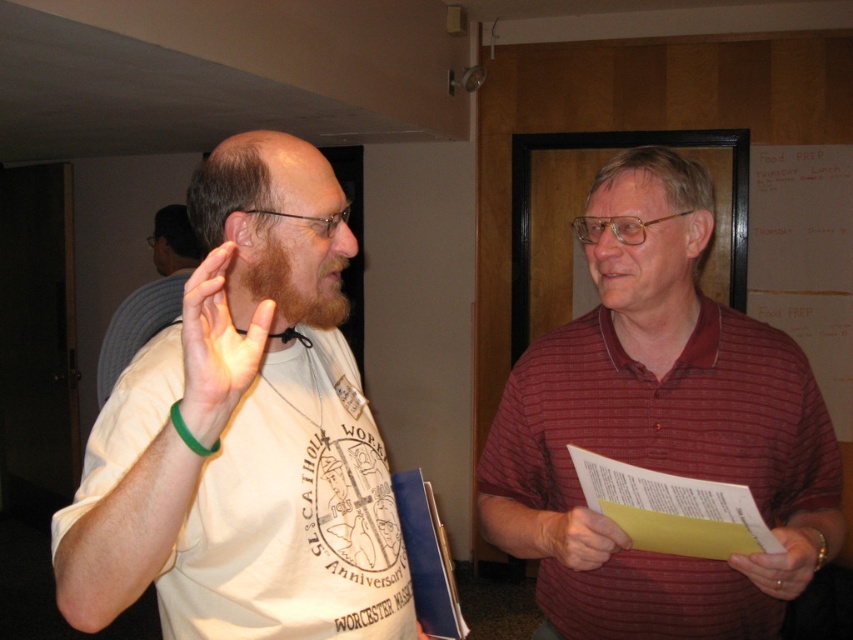
Can you confirm if matte white t-shirt at left is positioned above striped cotton shirt at center?

No, matte white t-shirt at left is not above striped cotton shirt at center.

Is matte white t-shirt at left wider than striped cotton shirt at center?

In fact, matte white t-shirt at left might be narrower than striped cotton shirt at center.

The image size is (853, 640). Find the location of `matte white t-shirt at left`. matte white t-shirt at left is located at coordinates (241, 433).

Does matte white t-shirt at left have a smaller size compared to matte white shirt at center?

Indeed, matte white t-shirt at left has a smaller size compared to matte white shirt at center.

Is the position of matte white t-shirt at left less distant than that of matte white shirt at center?

That is True.

Does point (344, 516) come closer to viewer compared to point (160, 234)?

Yes.

Find the location of `matte white t-shirt at left`. matte white t-shirt at left is located at coordinates (241, 433).

Looking at this image, can you confirm if striped cotton shirt at center is shorter than matte white shirt at center?

Incorrect, striped cotton shirt at center's height does not fall short of matte white shirt at center's.

Can you confirm if striped cotton shirt at center is smaller than matte white shirt at center?

Indeed, striped cotton shirt at center has a smaller size compared to matte white shirt at center.

Does point (567, 413) come closer to viewer compared to point (167, 280)?

Yes.

You are a GUI agent. You are given a task and a screenshot of the screen. Output one action in this format:
    pyautogui.click(x=<x>, y=<y>)
    Task: Click on the striped cotton shirt at center
    The image size is (853, 640).
    Given the screenshot: What is the action you would take?
    pyautogui.click(x=659, y=428)